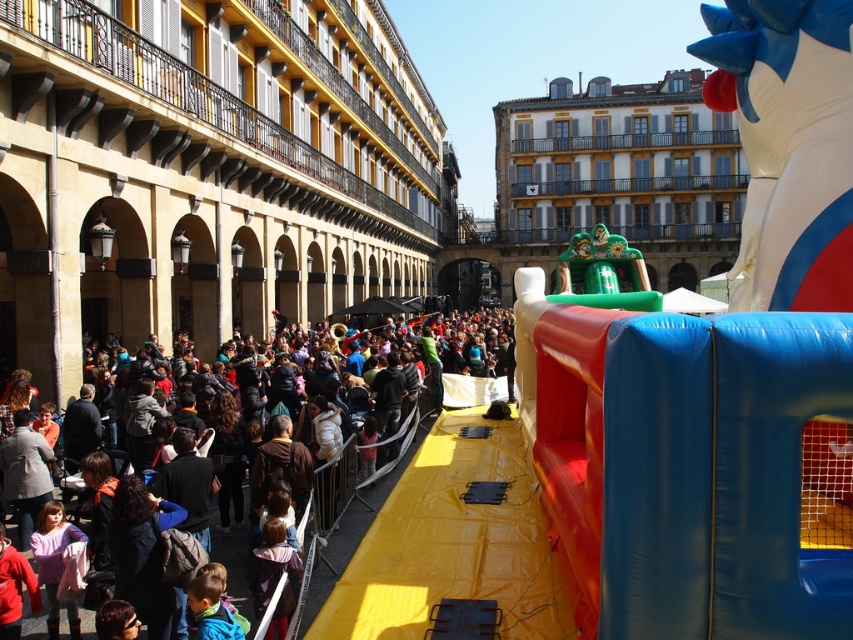
Who is positioned more to the left, multicolored fabric crowd at center or light brown fabric jacket at center?

light brown fabric jacket at center

Looking at this image, is the position of multicolored fabric crowd at center more distant than that of light brown fabric jacket at center?

No, it is in front of light brown fabric jacket at center.

Where is `multicolored fabric crowd at center`? multicolored fabric crowd at center is located at coordinates (355, 529).

Does blue rubber slide at center have a lesser height compared to light brown fabric jacket at center?

Incorrect, blue rubber slide at center's height does not fall short of light brown fabric jacket at center's.

Describe the element at coordinates (682, 465) in the screenshot. I see `blue rubber slide at center` at that location.

I want to click on blue rubber slide at center, so pyautogui.click(x=682, y=465).

Can you confirm if blue rubber slide at center is positioned above multicolored fabric crowd at center?

Correct, blue rubber slide at center is located above multicolored fabric crowd at center.

Does blue rubber slide at center appear on the right side of multicolored fabric crowd at center?

Correct, you'll find blue rubber slide at center to the right of multicolored fabric crowd at center.

You are a GUI agent. You are given a task and a screenshot of the screen. Output one action in this format:
    pyautogui.click(x=<x>, y=<y>)
    Task: Click on the blue rubber slide at center
    This screenshot has height=640, width=853.
    Given the screenshot: What is the action you would take?
    pyautogui.click(x=682, y=465)